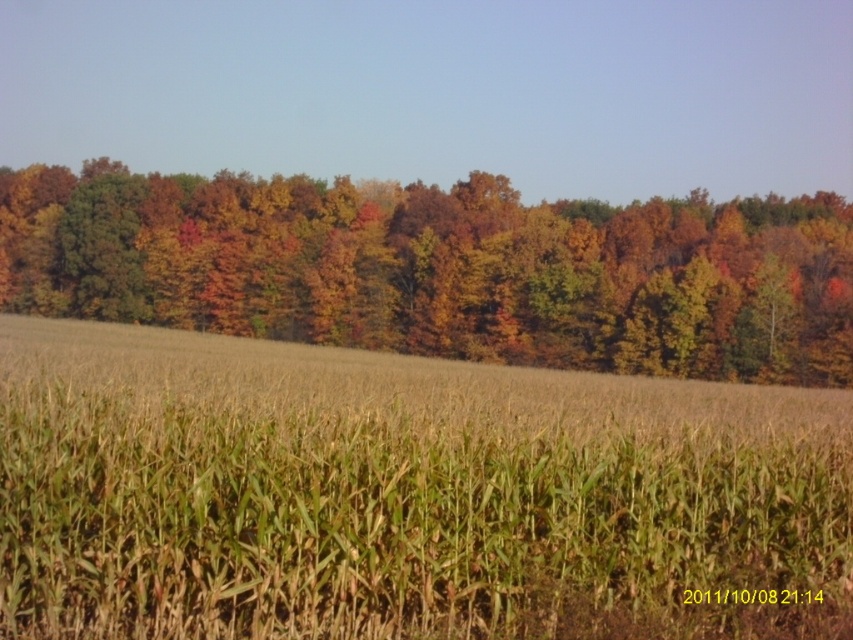
You are standing in the middle of the field and see both the green matte wheat field at center and the autumn leaves at center. Which one is nearer to you?

The green matte wheat field at center is closer to the viewer than autumn leaves at center.

You are standing in the middle of the rural landscape scene. You see the green matte wheat field at center and the autumn leaves at center. Which one is closer to you?

The green matte wheat field at center is positioned under autumn leaves at center, so the autumn leaves at center are closer to you.